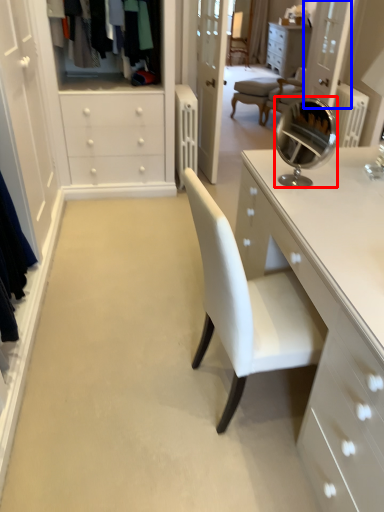
Question: Which of the following is the farthest to the observer, mirror (highlighted by a red box) or glass door (highlighted by a blue box)?

Choices:
 (A) mirror
 (B) glass door

Answer: (B)